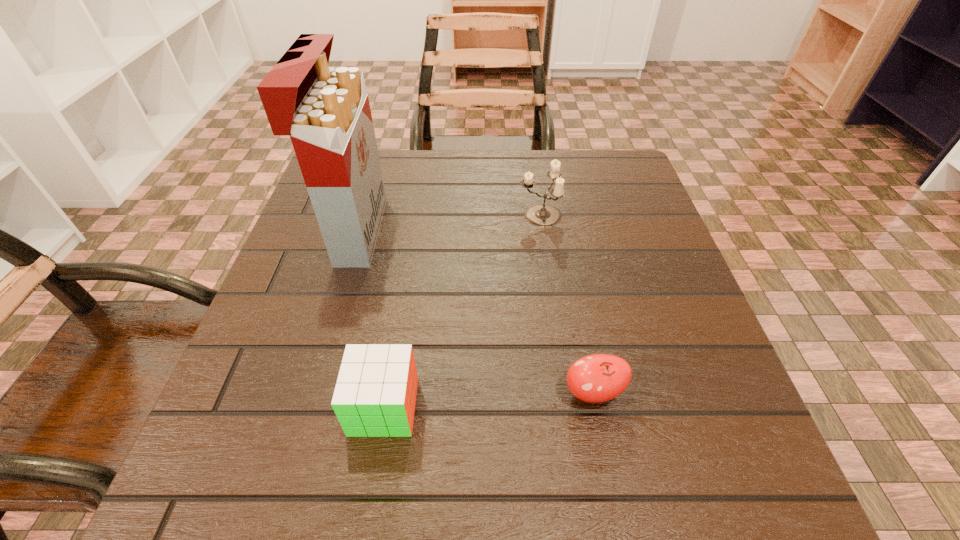
In order to click on free space that is in between the second tallest object and the apple in this screenshot , I will do `click(566, 304)`.

At what (x,y) coordinates should I click in order to perform the action: click on blank region between the cube and the leftmost object. Please return your answer as a coordinate pair (x, y). The image size is (960, 540). Looking at the image, I should click on (371, 319).

In order to click on free space between the apple and the tallest object in this screenshot , I will do `click(474, 312)`.

The width and height of the screenshot is (960, 540). In order to click on empty location between the second tallest object and the apple in this screenshot , I will do (x=566, y=304).

At what (x,y) coordinates should I click in order to perform the action: click on blank region between the third object from right to left and the second tallest object. Please return your answer as a coordinate pair (x, y). This screenshot has height=540, width=960. Looking at the image, I should click on (462, 311).

At what (x,y) coordinates should I click in order to perform the action: click on free area in between the second object from left to right and the tallest object. Please return your answer as a coordinate pair (x, y). This screenshot has height=540, width=960. Looking at the image, I should click on (371, 319).

Where is `vacant area between the cigarette case and the candle holder`? The height and width of the screenshot is (540, 960). vacant area between the cigarette case and the candle holder is located at coordinates (448, 223).

Find the location of a particular element. The width and height of the screenshot is (960, 540). empty space that is in between the cube and the candle holder is located at coordinates (462, 311).

Where is `vacant area that lies between the leftmost object and the second object from left to right`? This screenshot has width=960, height=540. vacant area that lies between the leftmost object and the second object from left to right is located at coordinates (371, 319).

The height and width of the screenshot is (540, 960). In order to click on empty space that is in between the apple and the leftmost object in this screenshot , I will do `click(474, 312)`.